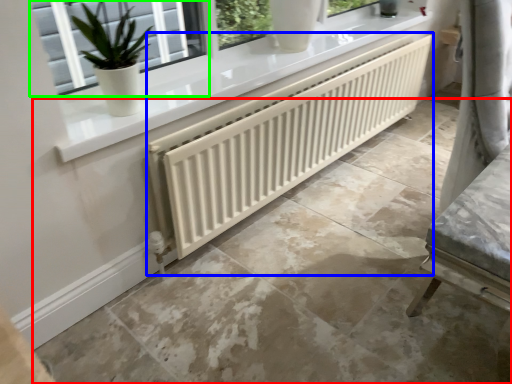
Question: Which is farther away from concrete (highlighted by a red box)? radiator (highlighted by a blue box) or window (highlighted by a green box)?

Choices:
 (A) radiator
 (B) window

Answer: (B)